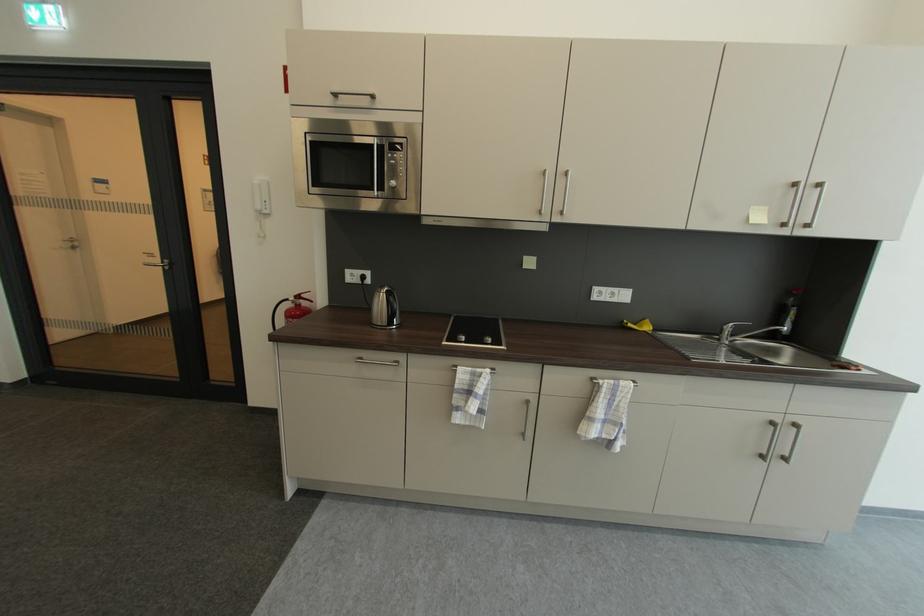
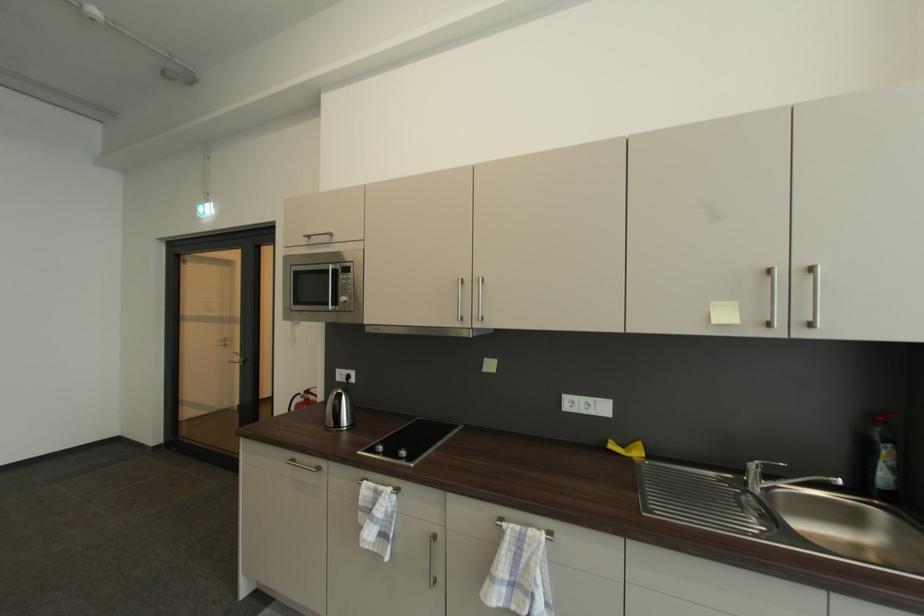
Locate, in the second image, the point that corresponds to (337,95) in the first image.

(311, 237)